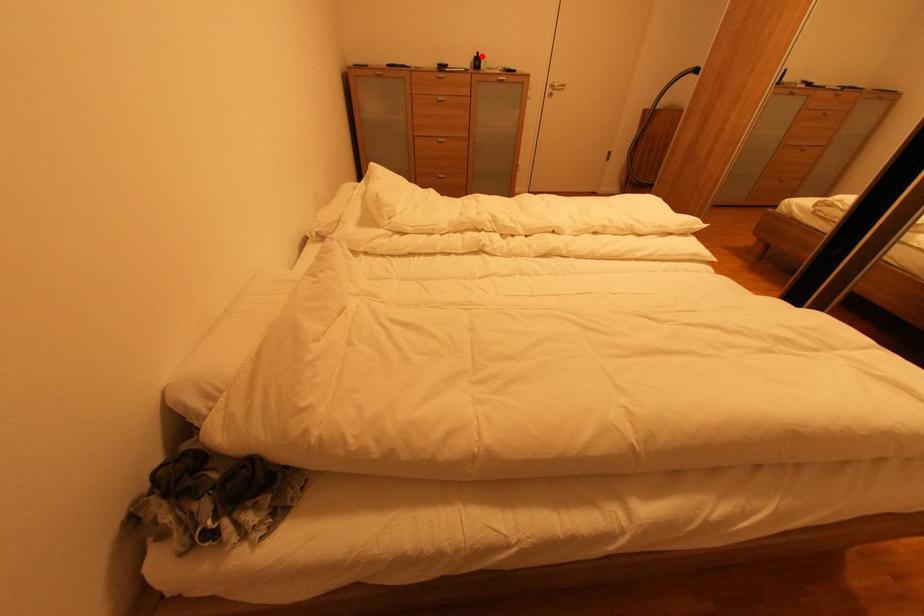
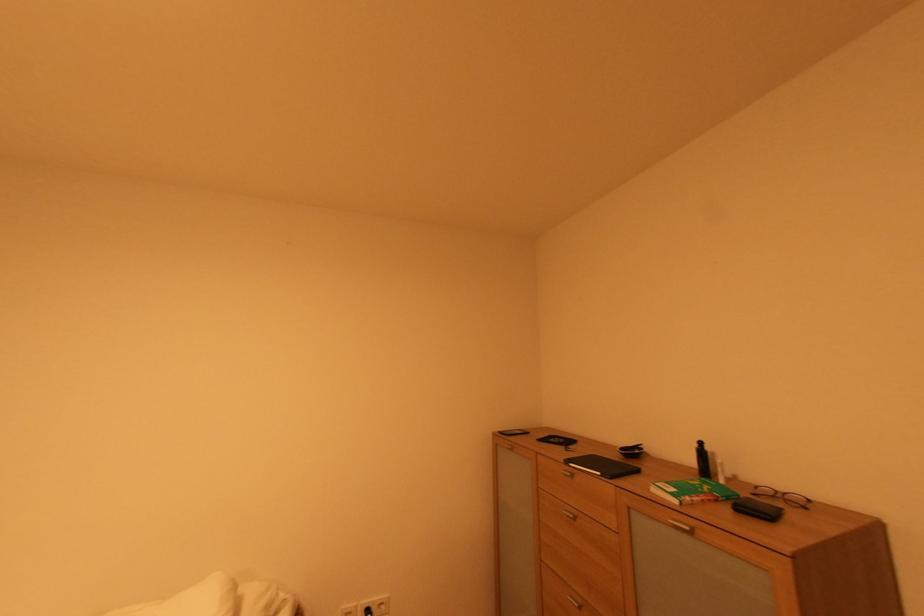
Question: A red point is marked in image1. In image2, is the corresponding 3D point closer to the camera or farther? Reply with the corresponding letter.

Choices:
 (A) The corresponding 3D point is closer.
 (B) The corresponding 3D point is farther.

Answer: (B)